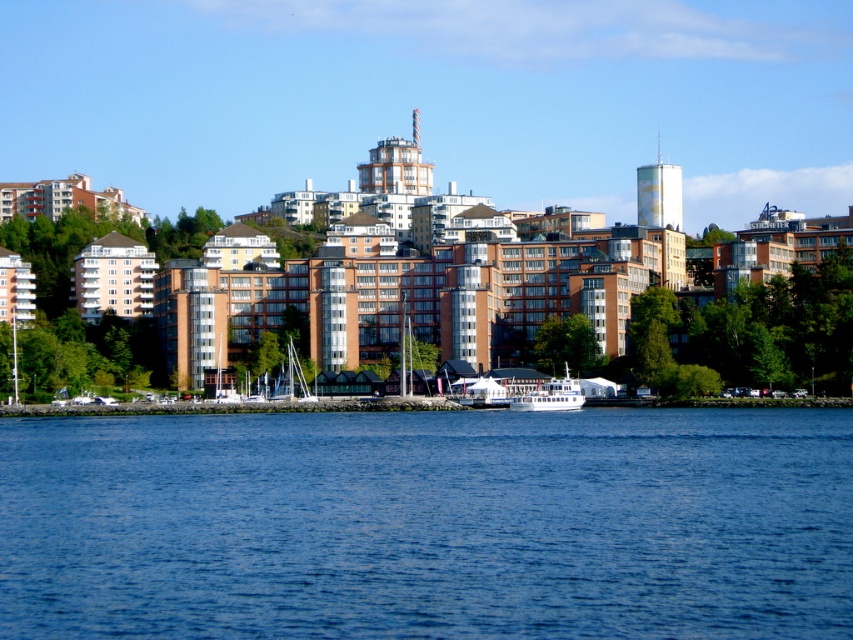
You are a photographer planning to capture a reflection shot of the white matte sailboat at center in the blue liquid water at center. Based on the scene, will the reflection of the sailboat appear to the left or right of the boat itself?

The blue liquid water at center is positioned on the left side of white matte sailboat at center, so the reflection of the sailboat will appear to the left of the boat itself in the water.

In the waterfront scene, there is a white glossy ferry at center and a small white boat anchored near the shore. Which object is positioned closer to the point with coordinates (550, 396)?

The white glossy ferry at center is positioned at point (550, 396), so it is exactly at that coordinate point. The small white boat anchored near the shore is not mentioned in relation to this coordinate, so the ferry is closer.

You are planning to take a boat trip and need to choose between the white glossy ferry at center and the white matte sailboat at center. Which one can accommodate more passengers?

The white glossy ferry at center has a larger size compared to the white matte sailboat at center, so it can accommodate more passengers.